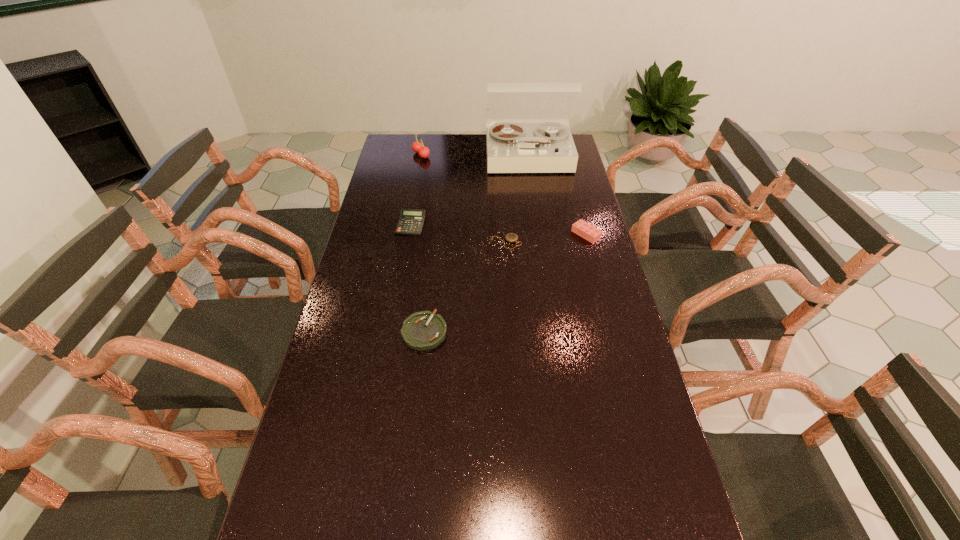
You are a GUI agent. You are given a task and a screenshot of the screen. Output one action in this format:
    pyautogui.click(x=<x>, y=<y>)
    Task: Click on the object present at the far right corner
    This screenshot has height=540, width=960.
    Given the screenshot: What is the action you would take?
    pyautogui.click(x=511, y=148)

In the image, there is a desktop. Where is `vacant space at the far edge`? vacant space at the far edge is located at coordinates (479, 151).

Locate an element on the screen. The width and height of the screenshot is (960, 540). vacant space at the left edge is located at coordinates (385, 196).

At what (x,y) coordinates should I click in order to perform the action: click on vacant region at the right edge of the desktop. Please return your answer as a coordinate pair (x, y). This screenshot has width=960, height=540. Looking at the image, I should click on (589, 258).

The height and width of the screenshot is (540, 960). I want to click on free space between the fourth tallest object and the cherry, so click(x=416, y=190).

The height and width of the screenshot is (540, 960). Find the location of `free spot between the third shortest object and the fifth tallest object`. free spot between the third shortest object and the fifth tallest object is located at coordinates (418, 278).

Locate an element on the screen. This screenshot has height=540, width=960. free space that is in between the shortest object and the calculator is located at coordinates (459, 233).

Find the location of a particular element. free space that is in between the record player and the shortest object is located at coordinates (517, 200).

Find the location of a particular element. The width and height of the screenshot is (960, 540). free space between the second tallest object and the record player is located at coordinates (475, 156).

At what (x,y) coordinates should I click in order to perform the action: click on vacant area that lies between the third shortest object and the record player. Please return your answer as a coordinate pair (x, y). Image resolution: width=960 pixels, height=540 pixels. Looking at the image, I should click on (469, 191).